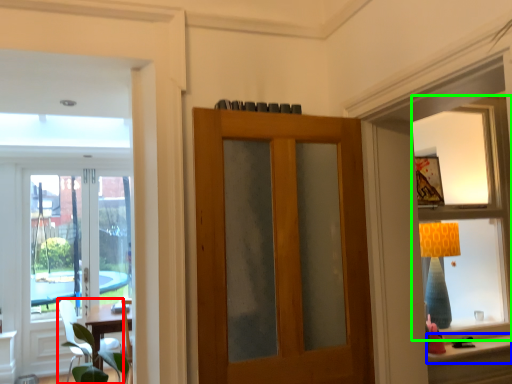
Question: Which is farther away from chair (highlighted by a red box)? window sill (highlighted by a blue box) or window (highlighted by a green box)?

Choices:
 (A) window sill
 (B) window

Answer: (B)